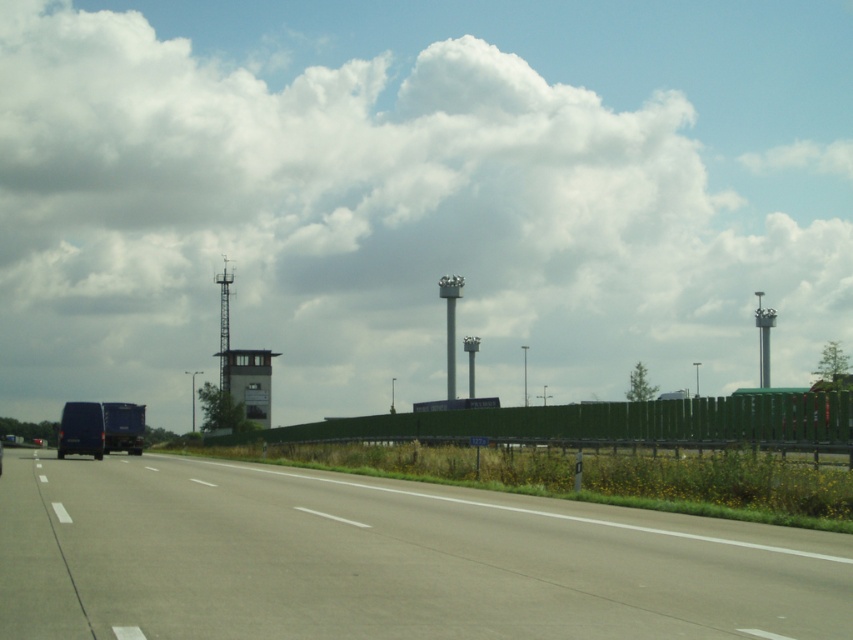
Is point (103, 422) closer to camera compared to point (225, 339)?

Yes, point (103, 422) is closer to viewer.

Is matte black van at center bigger than metallic gray control tower at center?

No.

This screenshot has width=853, height=640. Describe the element at coordinates (100, 428) in the screenshot. I see `matte black van at center` at that location.

Image resolution: width=853 pixels, height=640 pixels. Find the location of `matte black van at center`. matte black van at center is located at coordinates (100, 428).

Between point (50, 28) and point (97, 412), which one is positioned in front?

Point (97, 412)

Does point (184, 134) come closer to viewer compared to point (119, 432)?

No, it is not.

Which is in front, point (851, 266) or point (68, 417)?

Point (68, 417) is more forward.

In order to click on white fluffy cloud at upper center in this screenshot , I will do `click(418, 195)`.

Does white fluffy cloud at upper center appear under metallic gray control tower at center?

No, white fluffy cloud at upper center is not below metallic gray control tower at center.

I want to click on white fluffy cloud at upper center, so click(x=418, y=195).

Between point (808, 349) and point (228, 300), which one is positioned behind?

The point (808, 349) is more distant.

This screenshot has width=853, height=640. Find the location of `white fluffy cloud at upper center`. white fluffy cloud at upper center is located at coordinates (418, 195).